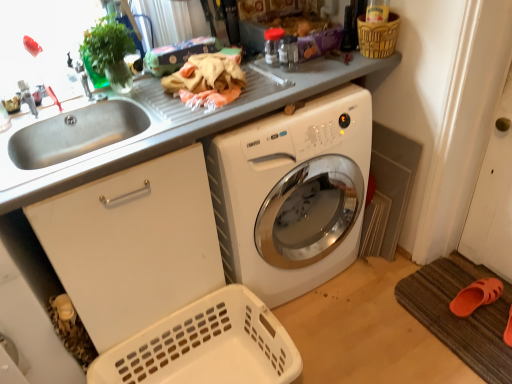
At what (x,y) coordinates should I click in order to perform the action: click on unoccupied region to the right of white plastic basket at lower left, the 1th basket viewed from the left. Please return your answer as a coordinate pair (x, y). The height and width of the screenshot is (384, 512). Looking at the image, I should click on (347, 333).